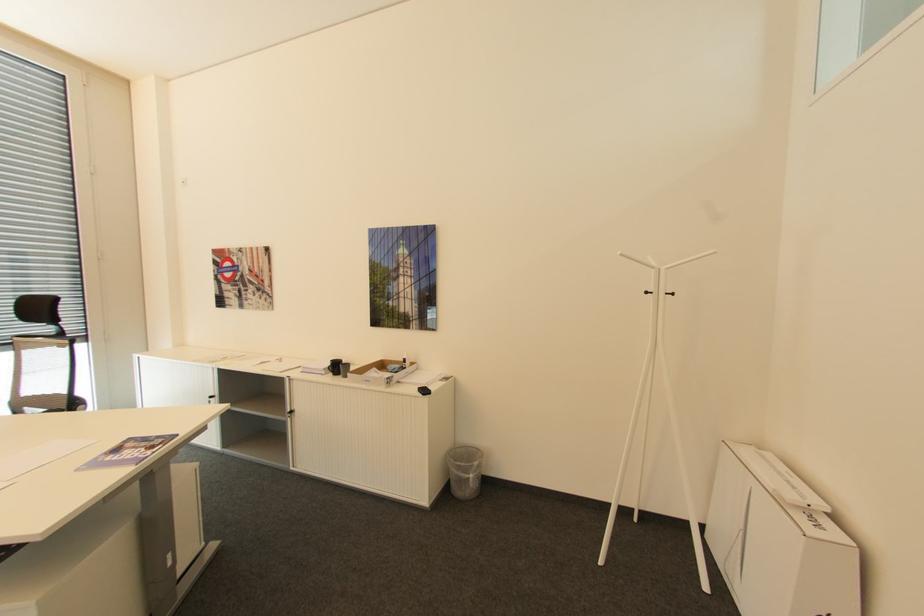
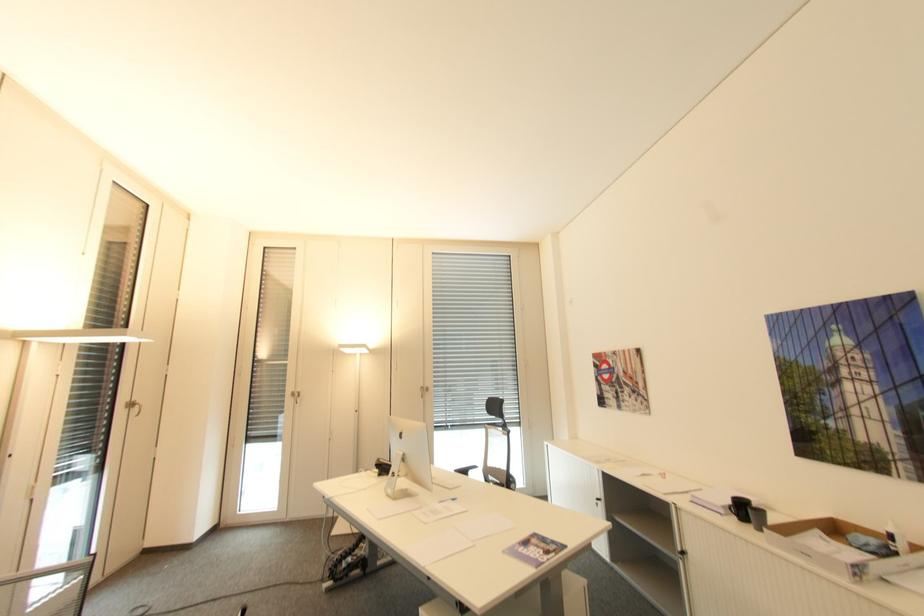
The point at (333, 363) is marked in the first image. Where is the corresponding point in the second image?

(734, 501)